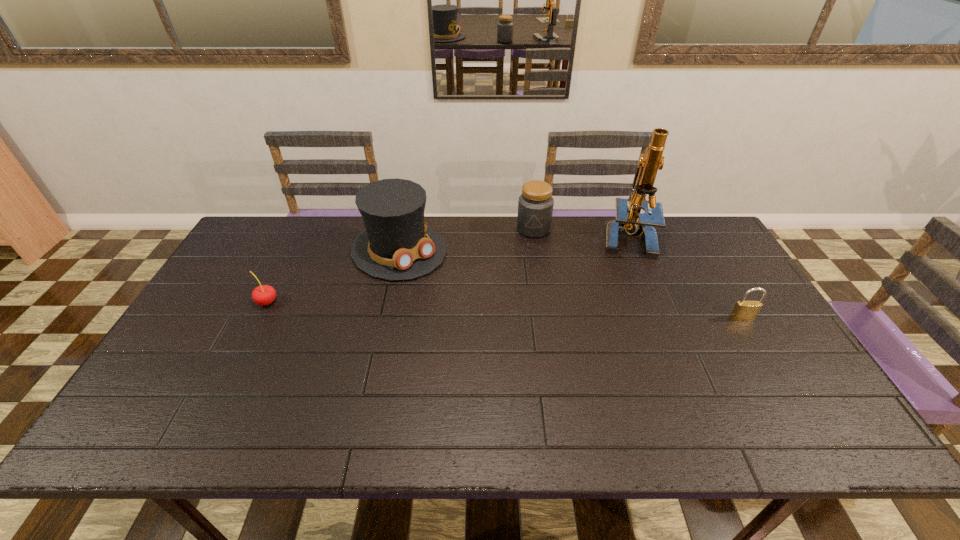
I want to click on free space on the desktop that is between the second nearest object and the nearest object and is positioned on the surface of the third shortest object near the warning symbol, so click(x=513, y=310).

The image size is (960, 540). I want to click on vacant spot on the desktop that is between the leftmost object and the rightmost object and is positioned with goggles on the front of the second object from left to right, so click(x=470, y=308).

The width and height of the screenshot is (960, 540). Find the location of `vacant spot on the desktop that is between the leftmost object and the padlock and is positioned at the eyepiece of the second object from right to left`. vacant spot on the desktop that is between the leftmost object and the padlock and is positioned at the eyepiece of the second object from right to left is located at coordinates (566, 312).